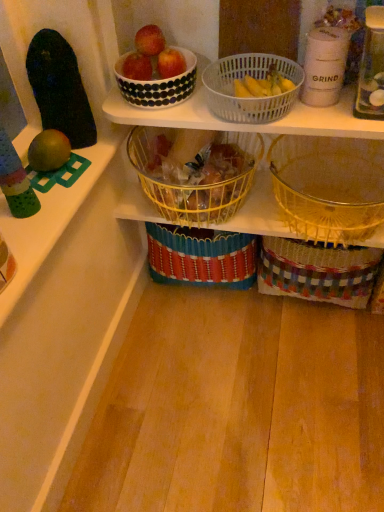
Question: Is yellow wire basket at center, marked as the third basket in a right-to-left arrangement, completely or partially inside matte black bowl at upper center, positioned as the 1th apple in left-to-right order?

Choices:
 (A) no
 (B) yes

Answer: (A)

Question: Considering the relative positions of matte black bowl at upper center, positioned as the 1th apple in left-to-right order, and yellow wire basket at center, positioned as the first basket in left-to-right order, in the image provided, is matte black bowl at upper center, positioned as the 1th apple in left-to-right order, to the left of yellow wire basket at center, positioned as the first basket in left-to-right order, from the viewer's perspective?

Choices:
 (A) no
 (B) yes

Answer: (B)

Question: Does matte black bowl at upper center, which appears as the 3th apple when viewed from the right, have a lesser width compared to yellow wire basket at center, positioned as the first basket in left-to-right order?

Choices:
 (A) yes
 (B) no

Answer: (A)

Question: Does matte black bowl at upper center, which appears as the 3th apple when viewed from the right, appear on the right side of yellow wire basket at center, marked as the third basket in a right-to-left arrangement?

Choices:
 (A) no
 (B) yes

Answer: (A)

Question: Does matte black bowl at upper center, which appears as the 3th apple when viewed from the right, lie behind yellow wire basket at center, marked as the third basket in a right-to-left arrangement?

Choices:
 (A) yes
 (B) no

Answer: (A)

Question: In terms of height, does shiny red apple at upper center, the 2th apple when ordered from right to left, look taller or shorter compared to white dotted bowl at upper center?

Choices:
 (A) tall
 (B) short

Answer: (B)

Question: From the image's perspective, is shiny red apple at upper center, the second apple when ordered from left to right, located above or below white dotted bowl at upper center?

Choices:
 (A) below
 (B) above

Answer: (B)

Question: In terms of width, does shiny red apple at upper center, the 2th apple when ordered from right to left, look wider or thinner when compared to white dotted bowl at upper center?

Choices:
 (A) thin
 (B) wide

Answer: (A)

Question: In terms of size, does shiny red apple at upper center, the 2th apple when ordered from right to left, appear bigger or smaller than white dotted bowl at upper center?

Choices:
 (A) big
 (B) small

Answer: (B)

Question: Do you think yellow woven basket at lower right, placed as the first basket when sorted from right to left, is within yellow plastic bananas at upper center, or outside of it?

Choices:
 (A) inside
 (B) outside

Answer: (B)

Question: Considering the positions of yellow woven basket at lower right, arranged as the 3th basket when viewed from the left, and yellow plastic bananas at upper center in the image, is yellow woven basket at lower right, arranged as the 3th basket when viewed from the left, bigger or smaller than yellow plastic bananas at upper center?

Choices:
 (A) big
 (B) small

Answer: (A)

Question: From the image's perspective, is yellow woven basket at lower right, arranged as the 3th basket when viewed from the left, positioned above or below yellow plastic bananas at upper center?

Choices:
 (A) below
 (B) above

Answer: (A)

Question: Looking at their shapes, would you say yellow woven basket at lower right, arranged as the 3th basket when viewed from the left, is wider or thinner than yellow plastic bananas at upper center?

Choices:
 (A) thin
 (B) wide

Answer: (B)

Question: Visually, is woven multicolored basket at lower right positioned to the left or to the right of shiny red apple at upper center, the 2th apple when ordered from right to left?

Choices:
 (A) left
 (B) right

Answer: (B)

Question: Is woven multicolored basket at lower right bigger or smaller than shiny red apple at upper center, the 2th apple when ordered from right to left?

Choices:
 (A) small
 (B) big

Answer: (B)